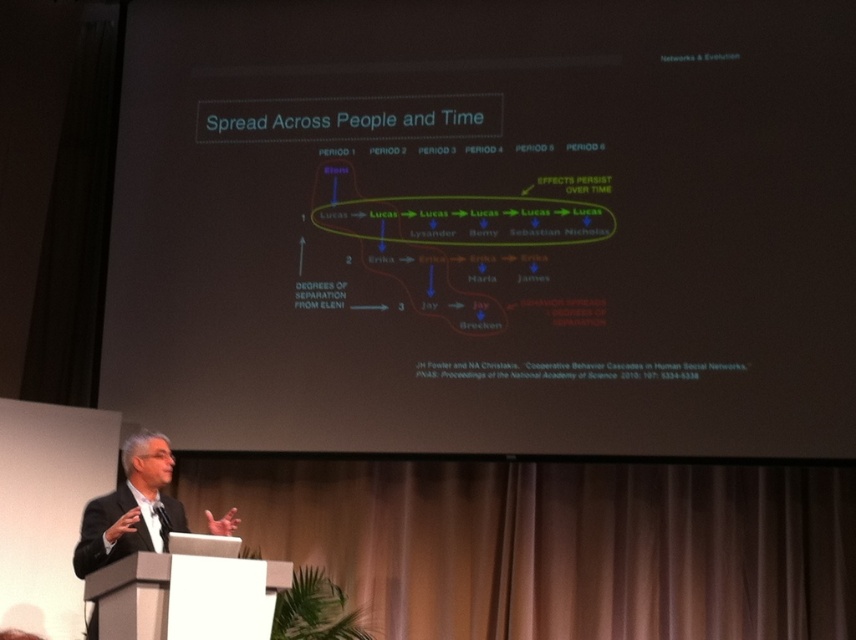
Looking at this image, can you confirm if black matte projection screen at upper center is wider than black suit at lower left?

Correct, the width of black matte projection screen at upper center exceeds that of black suit at lower left.

This screenshot has height=640, width=856. Find the location of `black matte projection screen at upper center`. black matte projection screen at upper center is located at coordinates tap(486, 227).

This screenshot has width=856, height=640. Identify the location of black matte projection screen at upper center. (486, 227).